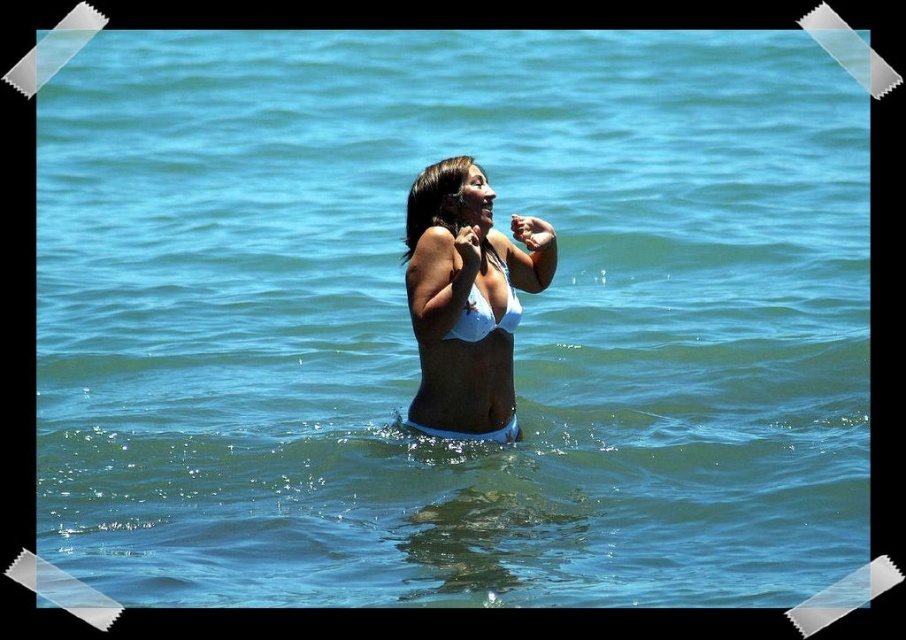
Question: Can you confirm if white matte bikini at center is smaller than white matte bikini top at center?

Choices:
 (A) yes
 (B) no

Answer: (B)

Question: Is white matte bikini at center further to camera compared to white matte bikini top at center?

Choices:
 (A) yes
 (B) no

Answer: (B)

Question: Which of the following is the farthest from the observer?

Choices:
 (A) white matte bikini top at center
 (B) white matte bikini at center

Answer: (A)

Question: Does white matte bikini at center have a smaller size compared to white matte bikini top at center?

Choices:
 (A) yes
 (B) no

Answer: (B)

Question: Which point is closer to the camera?

Choices:
 (A) (469, 317)
 (B) (449, 388)

Answer: (A)